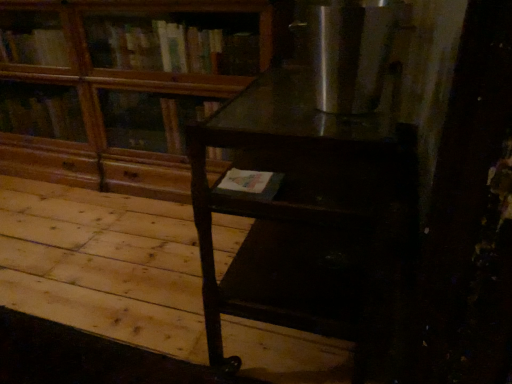
Measure the distance between point (350, 104) and camera.

Point (350, 104) and camera are 33.23 inches apart from each other.

In order to face dark wood table at center, should I rotate leftwards or rightwards?

Rotate left and turn 14.814 degrees.

The width and height of the screenshot is (512, 384). What do you see at coordinates (309, 217) in the screenshot?
I see `dark wood table at center` at bounding box center [309, 217].

In order to click on stainless steel refrigerator at upper right in this screenshot , I will do `click(348, 49)`.

Is point (411, 146) positioned in front of point (383, 3)?

No, it is behind (383, 3).

Considering the sizes of objects dark wood table at center and stainless steel refrigerator at upper right in the image provided, who is bigger, dark wood table at center or stainless steel refrigerator at upper right?

With larger size is dark wood table at center.

Is dark wood table at center oriented towards stainless steel refrigerator at upper right?

No, dark wood table at center is not oriented towards stainless steel refrigerator at upper right.

Considering the sizes of dark wood table at center and stainless steel refrigerator at upper right in the image, is dark wood table at center taller or shorter than stainless steel refrigerator at upper right?

dark wood table at center is taller than stainless steel refrigerator at upper right.

Would you say dark wood table at center is inside or outside dark wood table at center?

dark wood table at center exists outside the volume of dark wood table at center.

Is point (287, 330) behind point (370, 241)?

Yes, point (287, 330) is farther from viewer.

Consider the image. From the image's perspective, is dark wood table at center positioned above or below dark wood table at center?

dark wood table at center is situated lower than dark wood table at center in the image.

From a real-world perspective, between dark wood table at center and dark wood table at center, who is vertically lower?

dark wood table at center, from a real-world perspective.

Does dark wood table at center have a lesser width compared to wooden at upper left?

No, dark wood table at center is not thinner than wooden at upper left.

Which object is positioned more to the right, dark wood table at center or wooden at upper left?

Positioned to the right is dark wood table at center.

Would you say wooden at upper left is part of dark wood table at center's contents?

No, wooden at upper left is located outside of dark wood table at center.

From the image's perspective, would you say dark wood table at center is positioned over dark wood table at center?

Yes.

Is point (294, 160) farther from camera compared to point (173, 273)?

No, (294, 160) is closer to viewer.

From a real-world perspective, which object rests below the other?

dark wood table at center is physically lower.

Can you confirm if dark wood table at center is shorter than dark wood table at center?

No.

Can you confirm if stainless steel refrigerator at upper right is positioned to the left of dark wood table at center?

No, stainless steel refrigerator at upper right is not to the left of dark wood table at center.

Who is more distant, stainless steel refrigerator at upper right or dark wood table at center?

dark wood table at center is behind.

Does stainless steel refrigerator at upper right have a greater width compared to dark wood table at center?

No, stainless steel refrigerator at upper right is not wider than dark wood table at center.

From a real-world perspective, relative to dark wood table at center, is stainless steel refrigerator at upper right vertically above or below?

Clearly, from a real-world perspective, stainless steel refrigerator at upper right is above dark wood table at center.

At what (x,y) coordinates should I click in order to perform the action: click on bookcase on the left of dark wood table at center. Please return your answer as a coordinate pair (x, y). Looking at the image, I should click on (111, 102).

Consider the image. Are dark wood table at center and wooden at upper left located far from each other?

dark wood table at center is near wooden at upper left, not far away.

Is dark wood table at center bigger or smaller than wooden at upper left?

Considering their sizes, dark wood table at center takes up less space than wooden at upper left.

From a real-world perspective, between dark wood table at center and wooden at upper left, who is vertically higher?

In real-world perspective, wooden at upper left is above.

Find the location of a particular element. bookcase above the dark wood table at center (from a real-world perspective) is located at coordinates (111, 102).

Are wooden at upper left and dark wood table at center making contact?

There is a gap between wooden at upper left and dark wood table at center.

Is point (125, 56) in front of point (300, 167)?

That is False.

Is wooden at upper left smaller than dark wood table at center?

Incorrect, wooden at upper left is not smaller in size than dark wood table at center.

Identify the location of table that appears below the stainless steel refrigerator at upper right (from the image's perspective). (309, 217).

Find the location of `plywood that is on the left side of dark wood table at center`. plywood that is on the left side of dark wood table at center is located at coordinates (103, 265).

Based on their spatial positions, is wooden at upper left or dark wood table at center further from stainless steel refrigerator at upper right?

wooden at upper left.

From the image, which object appears to be farther from dark wood table at center, dark wood table at center or wooden at upper left?

Among the two, dark wood table at center is located further to dark wood table at center.

Looking at the image, which one is located further to dark wood table at center, stainless steel refrigerator at upper right or wooden at upper left?

Based on the image, wooden at upper left appears to be further to dark wood table at center.

Looking at the image, which one is located further to stainless steel refrigerator at upper right, dark wood table at center or dark wood table at center?

dark wood table at center.

Considering their positions, is dark wood table at center positioned closer to dark wood table at center than stainless steel refrigerator at upper right?

Among the two, dark wood table at center is located nearer to dark wood table at center.

Considering their positions, is dark wood table at center positioned closer to stainless steel refrigerator at upper right than wooden at upper left?

dark wood table at center lies closer to stainless steel refrigerator at upper right than the other object.

Looking at the image, which one is located further to dark wood table at center, wooden at upper left or stainless steel refrigerator at upper right?

Based on the image, stainless steel refrigerator at upper right appears to be further to dark wood table at center.

Estimate the real-world distances between objects in this image. Which object is further from dark wood table at center, wooden at upper left or stainless steel refrigerator at upper right?

Based on the image, wooden at upper left appears to be further to dark wood table at center.

This screenshot has width=512, height=384. In order to click on plywood between wooden at upper left and stainless steel refrigerator at upper right in the horizontal direction in this screenshot , I will do `click(103, 265)`.

Image resolution: width=512 pixels, height=384 pixels. I want to click on table between wooden at upper left and stainless steel refrigerator at upper right in the horizontal direction, so click(x=309, y=217).

Identify the location of plywood between wooden at upper left and dark wood table at center in the horizontal direction. (103, 265).

At what (x,y) coordinates should I click in order to perform the action: click on table between dark wood table at center and stainless steel refrigerator at upper right. Please return your answer as a coordinate pair (x, y). This screenshot has width=512, height=384. Looking at the image, I should click on [309, 217].